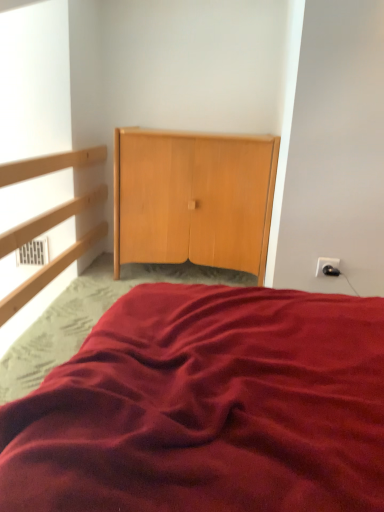
Question: Considering the positions of burgundy satin bed at center and black plastic outlet at upper right in the image, is burgundy satin bed at center taller or shorter than black plastic outlet at upper right?

Choices:
 (A) tall
 (B) short

Answer: (A)

Question: In the image, is burgundy satin bed at center positioned in front of or behind black plastic outlet at upper right?

Choices:
 (A) front
 (B) behind

Answer: (A)

Question: Based on their relative distances, which object is farther from the light wood dresser at center?

Choices:
 (A) black plastic outlet at upper right
 (B) burgundy satin bed at center

Answer: (B)

Question: Estimate the real-world distances between objects in this image. Which object is closer to the light wood dresser at center?

Choices:
 (A) burgundy satin bed at center
 (B) black plastic outlet at upper right

Answer: (B)